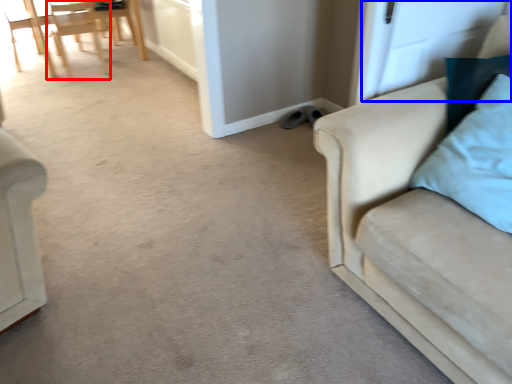
Question: Which object appears farthest to the camera in this image, chair (highlighted by a red box) or screen door (highlighted by a blue box)?

Choices:
 (A) chair
 (B) screen door

Answer: (A)